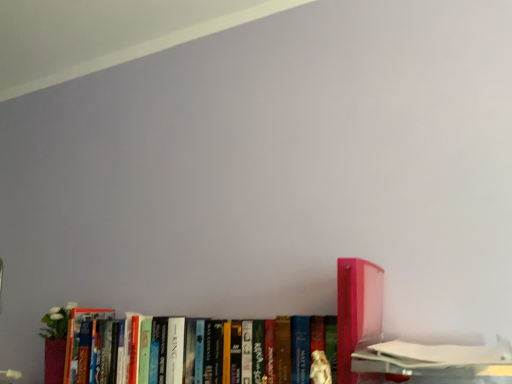
Question: In terms of size, does matte cardboard book at lower right, which is the 3th book in left-to-right order, appear bigger or smaller than pink plastic book at right, the second book positioned from the right?

Choices:
 (A) small
 (B) big

Answer: (B)

Question: Based on their positions, is matte cardboard book at lower right, which is the 3th book in left-to-right order, located to the left or right of pink plastic book at right, placed as the second book when sorted from left to right?

Choices:
 (A) right
 (B) left

Answer: (A)

Question: Which object is positioned closest to the pink plastic book at right, the second book positioned from the right?

Choices:
 (A) hardcover book at center, marked as the third book in a right-to-left arrangement
 (B) matte cardboard book at lower right, which is the 1th book from right to left

Answer: (B)

Question: Which is nearer to the pink plastic book at right, placed as the second book when sorted from left to right?

Choices:
 (A) matte cardboard book at lower right, which is the 1th book from right to left
 (B) hardcover book at center, arranged as the first book when viewed from the left

Answer: (A)